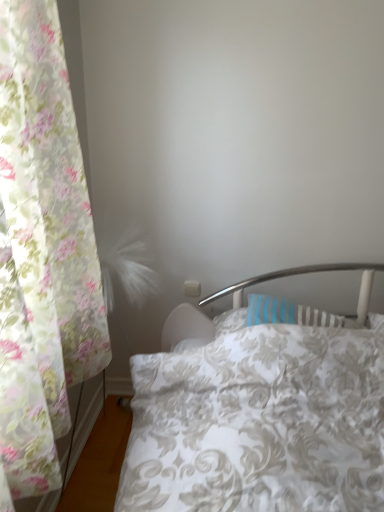
This screenshot has width=384, height=512. Identify the location of floral sheer curtain at left. (43, 248).

The width and height of the screenshot is (384, 512). What do you see at coordinates (43, 248) in the screenshot?
I see `floral sheer curtain at left` at bounding box center [43, 248].

This screenshot has height=512, width=384. What do you see at coordinates (259, 412) in the screenshot? I see `white floral duvet at center` at bounding box center [259, 412].

Measure the distance between white floral duvet at center and camera.

white floral duvet at center and camera are 1.03 meters apart from each other.

Where is `white floral duvet at center`? This screenshot has width=384, height=512. white floral duvet at center is located at coordinates (259, 412).

Locate an element on the screen. This screenshot has width=384, height=512. floral sheer curtain at left is located at coordinates (43, 248).

Which object is positioned more to the left, floral sheer curtain at left or white floral duvet at center?

From the viewer's perspective, floral sheer curtain at left appears more on the left side.

Is floral sheer curtain at left closer to camera compared to white floral duvet at center?

Yes.

Is point (22, 221) closer to camera compared to point (373, 455)?

Yes, point (22, 221) is in front of point (373, 455).

From the image's perspective, which is below, floral sheer curtain at left or white floral duvet at center?

white floral duvet at center, from the image's perspective.

From a real-world perspective, who is located higher, floral sheer curtain at left or white floral duvet at center?

In real-world perspective, floral sheer curtain at left is above.

Considering the relative sizes of floral sheer curtain at left and white floral duvet at center in the image provided, is floral sheer curtain at left wider than white floral duvet at center?

Incorrect, the width of floral sheer curtain at left does not surpass that of white floral duvet at center.

Considering the sizes of objects floral sheer curtain at left and white floral duvet at center in the image provided, who is taller, floral sheer curtain at left or white floral duvet at center?

floral sheer curtain at left.

Considering the sizes of floral sheer curtain at left and white floral duvet at center in the image, is floral sheer curtain at left bigger or smaller than white floral duvet at center?

Considering their sizes, floral sheer curtain at left takes up less space than white floral duvet at center.

Is floral sheer curtain at left located outside white floral duvet at center?

Yes, floral sheer curtain at left is located beyond the bounds of white floral duvet at center.

Is there a large distance between floral sheer curtain at left and white floral duvet at center?

Actually, floral sheer curtain at left and white floral duvet at center are a little close together.

Consider the image. Could you tell me if floral sheer curtain at left is facing white floral duvet at center?

Yes.

Identify the location of bed below the floral sheer curtain at left (from the image's perspective). (259, 412).

Considering the positions of objects white floral duvet at center and floral sheer curtain at left in the image provided, who is more to the left, white floral duvet at center or floral sheer curtain at left?

From the viewer's perspective, floral sheer curtain at left appears more on the left side.

Between white floral duvet at center and floral sheer curtain at left, which one is positioned in front?

floral sheer curtain at left is closer to the camera.

Does point (208, 492) appear closer or farther from the camera than point (36, 100)?

Point (208, 492) is farther from the camera than point (36, 100).

From the image's perspective, is white floral duvet at center located beneath floral sheer curtain at left?

Yes.

From a real-world perspective, who is located higher, white floral duvet at center or floral sheer curtain at left?

floral sheer curtain at left is physically above.

Which object is thinner, white floral duvet at center or floral sheer curtain at left?

With smaller width is floral sheer curtain at left.

In the scene shown: Considering the sizes of objects white floral duvet at center and floral sheer curtain at left in the image provided, who is shorter, white floral duvet at center or floral sheer curtain at left?

With less height is white floral duvet at center.

Between white floral duvet at center and floral sheer curtain at left, which one has larger size?

With larger size is white floral duvet at center.

Is white floral duvet at center located outside floral sheer curtain at left?

white floral duvet at center lies outside floral sheer curtain at left's area.

Is the surface of white floral duvet at center in direct contact with floral sheer curtain at left?

No, white floral duvet at center is not in contact with floral sheer curtain at left.

Is white floral duvet at center turned away from floral sheer curtain at left?

No, white floral duvet at center is not facing away from floral sheer curtain at left.

How different are the orientations of white floral duvet at center and floral sheer curtain at left in degrees?

The facing directions of white floral duvet at center and floral sheer curtain at left are 90.8 degrees apart.

Measure the distance from white floral duvet at center to floral sheer curtain at left.

white floral duvet at center is 22.72 inches away from floral sheer curtain at left.

Locate an element on the screen. Image resolution: width=384 pixels, height=512 pixels. bed below the floral sheer curtain at left (from a real-world perspective) is located at coordinates (259, 412).

Identify the location of bed that is below the floral sheer curtain at left (from the image's perspective). (259, 412).

The width and height of the screenshot is (384, 512). In order to click on curtain on the left of white floral duvet at center in this screenshot , I will do `click(43, 248)`.